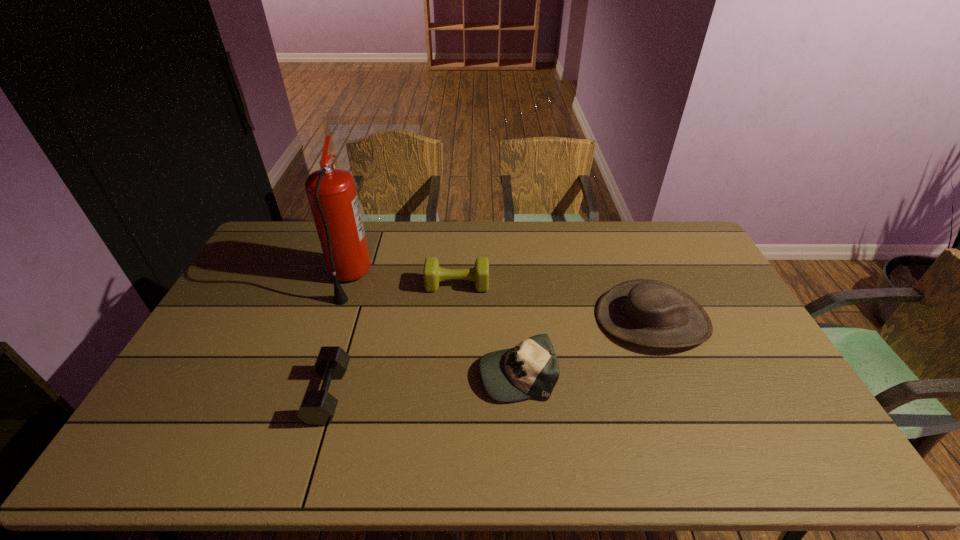
Where is `vacant point located between the nearer dumbbell and the baseball cap`? The height and width of the screenshot is (540, 960). vacant point located between the nearer dumbbell and the baseball cap is located at coordinates [422, 383].

This screenshot has width=960, height=540. In order to click on vacant point located between the baseball cap and the fire extinguisher in this screenshot , I will do `click(433, 326)`.

You are a GUI agent. You are given a task and a screenshot of the screen. Output one action in this format:
    pyautogui.click(x=<x>, y=<y>)
    Task: Click on the free area in between the cowboy hat and the baseball cap
    This screenshot has height=540, width=960.
    Given the screenshot: What is the action you would take?
    pyautogui.click(x=585, y=346)

Image resolution: width=960 pixels, height=540 pixels. What are the coordinates of `free point between the farther dumbbell and the left dumbbell` in the screenshot? It's located at (393, 339).

Where is `vacant space that's between the rightmost object and the baseball cap`? The image size is (960, 540). vacant space that's between the rightmost object and the baseball cap is located at coordinates (585, 346).

The width and height of the screenshot is (960, 540). What are the coordinates of `free point between the nearer dumbbell and the tallest object` in the screenshot? It's located at (339, 336).

In order to click on vacant space that is in between the baseball cap and the nearer dumbbell in this screenshot , I will do `click(422, 383)`.

This screenshot has height=540, width=960. Identify the location of vacant space that is in between the farther dumbbell and the cowboy hat. (555, 302).

Where is `free spot between the tallest object and the right dumbbell`? The height and width of the screenshot is (540, 960). free spot between the tallest object and the right dumbbell is located at coordinates (403, 281).

Locate an element on the screen. The height and width of the screenshot is (540, 960). the third closest object relative to the rightmost object is located at coordinates (317, 408).